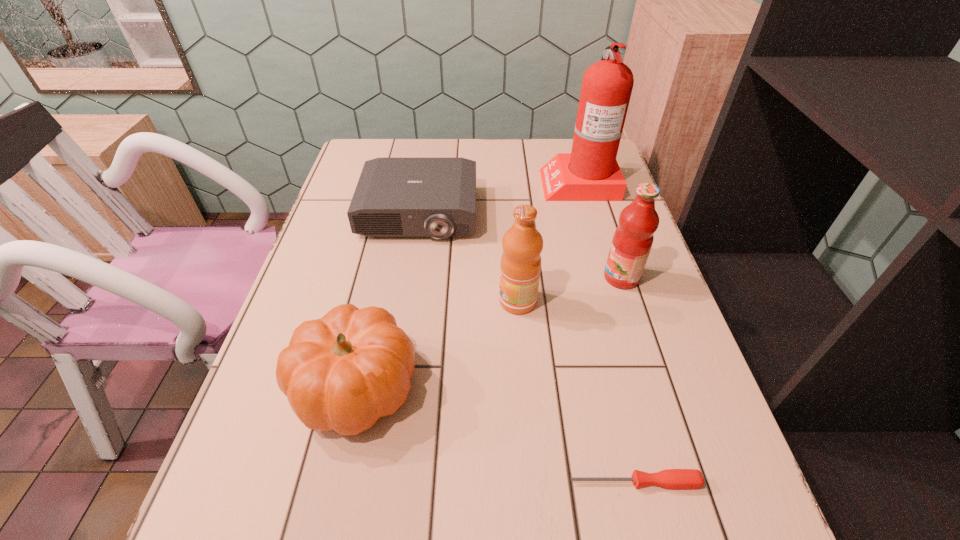
I want to click on unoccupied area between the fifth farthest object and the left fruit juice, so click(437, 344).

Where is `free space between the right fruit juice and the left fruit juice`? The image size is (960, 540). free space between the right fruit juice and the left fruit juice is located at coordinates (569, 289).

Find the location of a particular element. the third closest object to the fourth tallest object is located at coordinates (395, 197).

Where is `object that stands as the fifth closest to the second shortest object`? The image size is (960, 540). object that stands as the fifth closest to the second shortest object is located at coordinates (669, 478).

Image resolution: width=960 pixels, height=540 pixels. I want to click on vacant space that satisfies the following two spatial constraints: 1. on the front-facing side of the tallest object; 2. on the front-facing side of the second shortest object, so click(x=588, y=214).